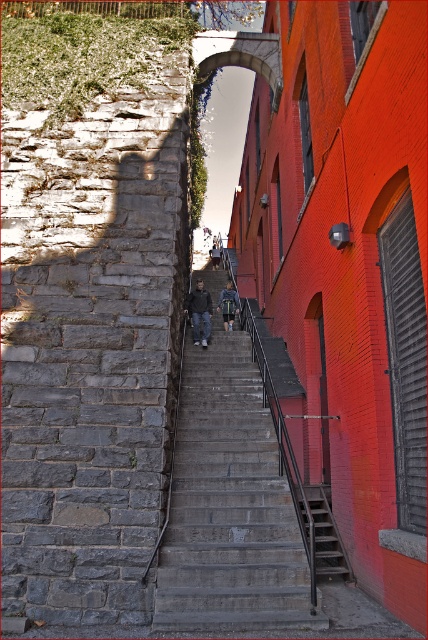
Question: Which object is positioned closest to the dark gray jeans at center?

Choices:
 (A) dark gray fabric jacket at center
 (B) denim jacket at center
 (C) metallic gray stairs at center

Answer: (B)

Question: Is metallic gray stairs at center positioned in front of denim jacket at center?

Choices:
 (A) no
 (B) yes

Answer: (B)

Question: Is denim jacket at center positioned at the back of dark gray jeans at center?

Choices:
 (A) yes
 (B) no

Answer: (B)

Question: Which of the following is the closest to the observer?

Choices:
 (A) (338, 572)
 (B) (214, 268)
 (C) (228, 324)

Answer: (A)

Question: Is dark gray fabric jacket at center bigger than denim jacket at center?

Choices:
 (A) yes
 (B) no

Answer: (A)

Question: Which point appears closest to the camera in this image?

Choices:
 (A) (279, 620)
 (B) (205, 340)

Answer: (A)